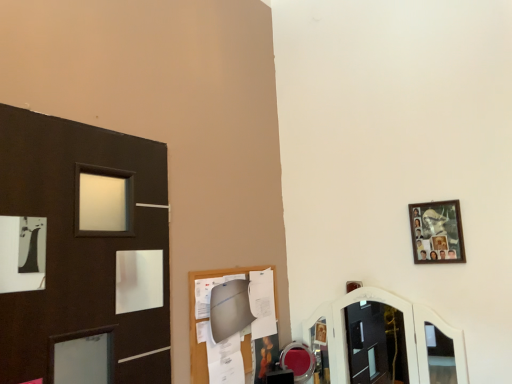
Question: Considering the positions of wooden photo frame at upper right and shiny red mirror at center in the image, is wooden photo frame at upper right bigger or smaller than shiny red mirror at center?

Choices:
 (A) small
 (B) big

Answer: (A)

Question: Considering their positions, is wooden photo frame at upper right located in front of or behind shiny red mirror at center?

Choices:
 (A) front
 (B) behind

Answer: (A)

Question: From a real-world perspective, relative to shiny red mirror at center, is wooden photo frame at upper right vertically above or below?

Choices:
 (A) below
 (B) above

Answer: (B)

Question: In terms of height, does shiny red mirror at center look taller or shorter compared to wooden photo frame at upper right?

Choices:
 (A) tall
 (B) short

Answer: (B)

Question: Is shiny red mirror at center wider or thinner than wooden photo frame at upper right?

Choices:
 (A) thin
 (B) wide

Answer: (B)

Question: From a real-world perspective, relative to wooden photo frame at upper right, is shiny red mirror at center vertically above or below?

Choices:
 (A) below
 (B) above

Answer: (A)

Question: In the image, is shiny red mirror at center positioned in front of or behind wooden photo frame at upper right?

Choices:
 (A) front
 (B) behind

Answer: (B)